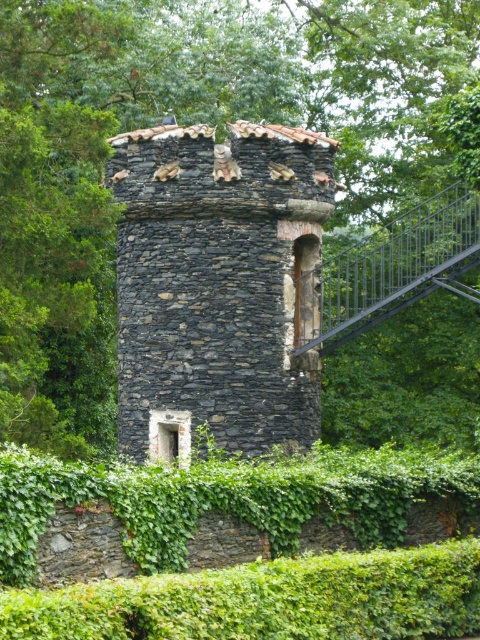
From the picture: Is green leafy tree at center smaller than rustic stone tower at center?

No, green leafy tree at center is not smaller than rustic stone tower at center.

Is green leafy tree at center in front of rustic stone tower at center?

Yes, it is.

The height and width of the screenshot is (640, 480). I want to click on green leafy tree at center, so click(x=187, y=122).

At what (x,y) coordinates should I click in order to perform the action: click on green leafy tree at center. Please return your answer as a coordinate pair (x, y). The height and width of the screenshot is (640, 480). Looking at the image, I should click on (187, 122).